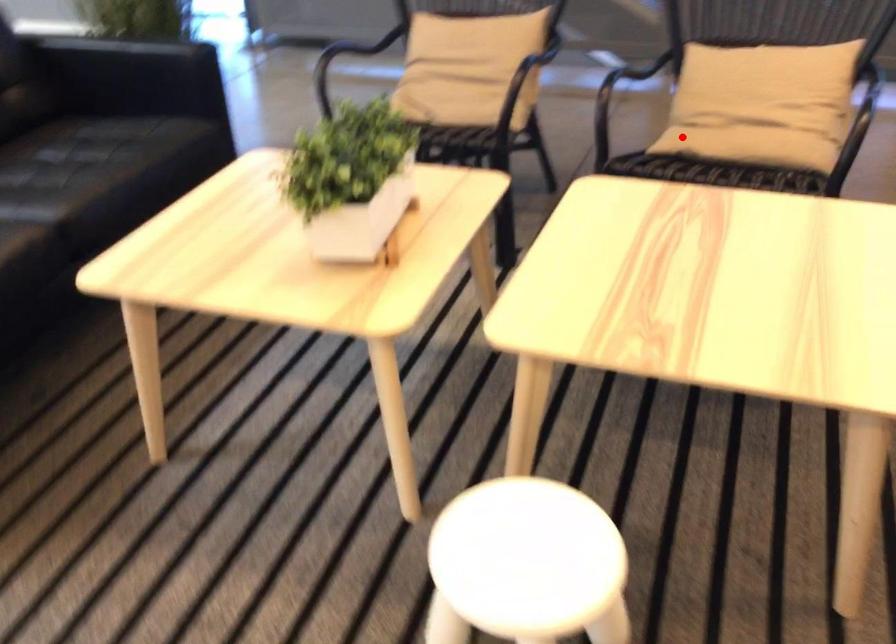
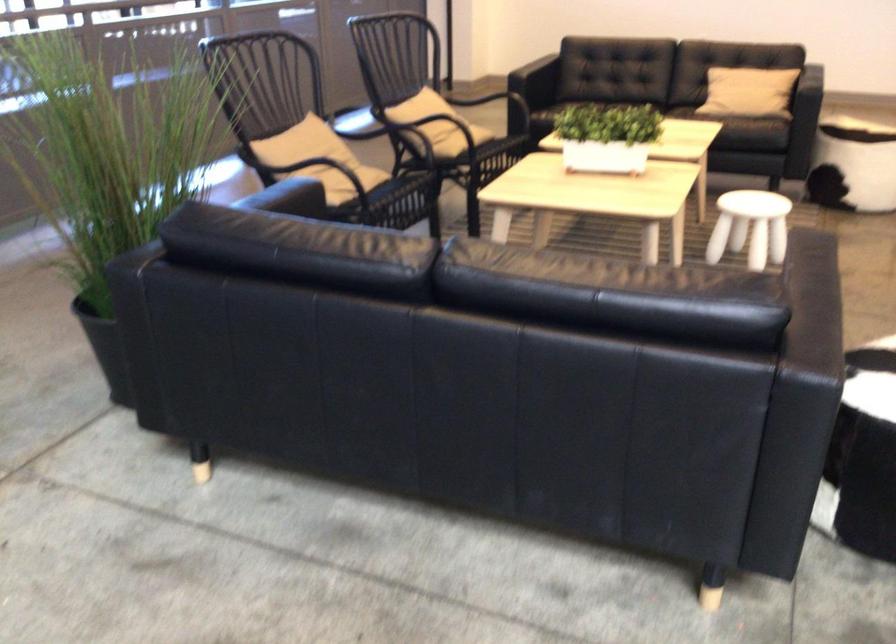
In the second image, find the point that corresponds to the highlighted location in the first image.

(462, 140)